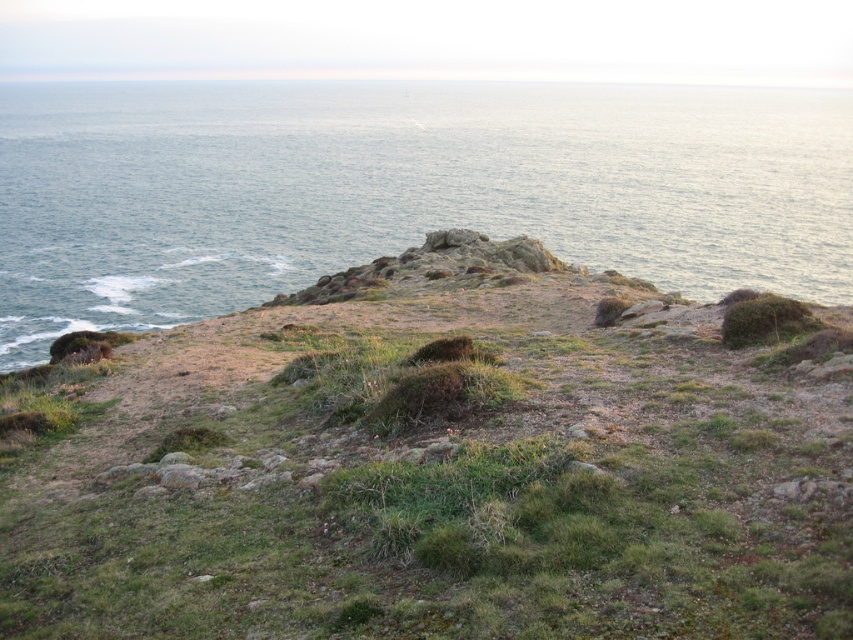
Question: Is green grassy hillside at center further to camera compared to blue water at upper center?

Choices:
 (A) yes
 (B) no

Answer: (B)

Question: Is green grassy hillside at center behind blue water at upper center?

Choices:
 (A) yes
 (B) no

Answer: (B)

Question: Does green grassy hillside at center appear on the right side of blue water at upper center?

Choices:
 (A) no
 (B) yes

Answer: (A)

Question: Among these objects, which one is farthest from the camera?

Choices:
 (A) green grassy hillside at center
 (B) blue water at upper center

Answer: (B)

Question: Which of the following is the closest to the observer?

Choices:
 (A) blue water at upper center
 (B) green grassy hillside at center

Answer: (B)